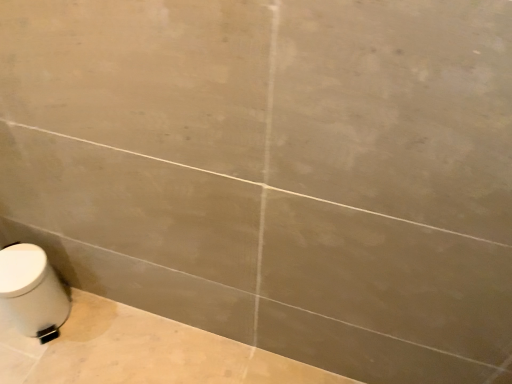
This screenshot has width=512, height=384. What do you see at coordinates (263, 262) in the screenshot?
I see `white glossy toilet at lower left` at bounding box center [263, 262].

You are a GUI agent. You are given a task and a screenshot of the screen. Output one action in this format:
    pyautogui.click(x=<x>, y=<y>)
    Task: Click on the white glossy toilet at lower left
    This screenshot has height=384, width=512.
    Given the screenshot: What is the action you would take?
    click(x=263, y=262)

The image size is (512, 384). Describe the element at coordinates (32, 292) in the screenshot. I see `white glossy toilet at lower left` at that location.

This screenshot has width=512, height=384. I want to click on white glossy toilet at lower left, so click(x=32, y=292).

Measure the distance between point (x=36, y=291) and camera.

The distance of point (x=36, y=291) from camera is 4.04 feet.

Identify the location of white glossy toilet at lower left. (263, 262).

Considering the positions of objects white glossy toilet at lower left and white glossy toilet at lower left in the image provided, who is more to the left, white glossy toilet at lower left or white glossy toilet at lower left?

Positioned to the left is white glossy toilet at lower left.

Is white glossy toilet at lower left in front of or behind white glossy toilet at lower left in the image?

Visually, white glossy toilet at lower left is located behind white glossy toilet at lower left.

Considering the positions of point (49, 330) and point (204, 179), is point (49, 330) closer or farther from the camera than point (204, 179)?

Point (49, 330) is positioned farther from the camera compared to point (204, 179).

From the image's perspective, which is above, white glossy toilet at lower left or white glossy toilet at lower left?

From the image's view, white glossy toilet at lower left is above.

From a real-world perspective, which object rests below the other?

white glossy toilet at lower left is physically lower.

Can you confirm if white glossy toilet at lower left is thinner than white glossy toilet at lower left?

No, white glossy toilet at lower left is not thinner than white glossy toilet at lower left.

Between white glossy toilet at lower left and white glossy toilet at lower left, which one has more height?

white glossy toilet at lower left.

Can you confirm if white glossy toilet at lower left is smaller than white glossy toilet at lower left?

Indeed, white glossy toilet at lower left has a smaller size compared to white glossy toilet at lower left.

Is white glossy toilet at lower left inside or outside of white glossy toilet at lower left?

white glossy toilet at lower left is spatially situated outside white glossy toilet at lower left.

Are white glossy toilet at lower left and white glossy toilet at lower left far apart?

No, white glossy toilet at lower left is in close proximity to white glossy toilet at lower left.

Is white glossy toilet at lower left looking in the opposite direction of white glossy toilet at lower left?

Yes.

At what (x,y) coordinates should I click in order to perform the action: click on bath that appears on the right of white glossy toilet at lower left. Please return your answer as a coordinate pair (x, y). The image size is (512, 384). Looking at the image, I should click on (263, 262).

From the picture: Which object is positioned more to the right, white glossy toilet at lower left or white glossy toilet at lower left?

From the viewer's perspective, white glossy toilet at lower left appears more on the right side.

Between white glossy toilet at lower left and white glossy toilet at lower left, which one is positioned behind?

white glossy toilet at lower left is further away from the camera.

Considering the positions of point (373, 243) and point (12, 274), is point (373, 243) closer or farther from the camera than point (12, 274)?

Point (373, 243) is positioned closer to the camera compared to point (12, 274).

From the image's perspective, does white glossy toilet at lower left appear higher than white glossy toilet at lower left?

Yes, from the image's perspective, white glossy toilet at lower left is above white glossy toilet at lower left.

From a real-world perspective, is white glossy toilet at lower left positioned above or below white glossy toilet at lower left?

Clearly, from a real-world perspective, white glossy toilet at lower left is above white glossy toilet at lower left.

Looking at their sizes, would you say white glossy toilet at lower left is wider or thinner than white glossy toilet at lower left?

Considering their sizes, white glossy toilet at lower left looks slimmer than white glossy toilet at lower left.

Looking at this image, is white glossy toilet at lower left shorter than white glossy toilet at lower left?

No.

Which of these two, white glossy toilet at lower left or white glossy toilet at lower left, is bigger?

white glossy toilet at lower left is bigger.

Does white glossy toilet at lower left contain white glossy toilet at lower left?

That's incorrect, white glossy toilet at lower left is not inside white glossy toilet at lower left.

Are white glossy toilet at lower left and white glossy toilet at lower left beside each other?

white glossy toilet at lower left and white glossy toilet at lower left are clearly separated.

Is white glossy toilet at lower left oriented away from white glossy toilet at lower left?

Yes, white glossy toilet at lower left's orientation is away from white glossy toilet at lower left.

This screenshot has width=512, height=384. What are the coordinates of `bath that appears above the white glossy toilet at lower left (from a real-world perspective)` in the screenshot? It's located at (263, 262).

This screenshot has height=384, width=512. Find the location of `bath lying above the white glossy toilet at lower left (from the image's perspective)`. bath lying above the white glossy toilet at lower left (from the image's perspective) is located at coordinates (263, 262).

Image resolution: width=512 pixels, height=384 pixels. I want to click on bath in front of the white glossy toilet at lower left, so click(x=263, y=262).